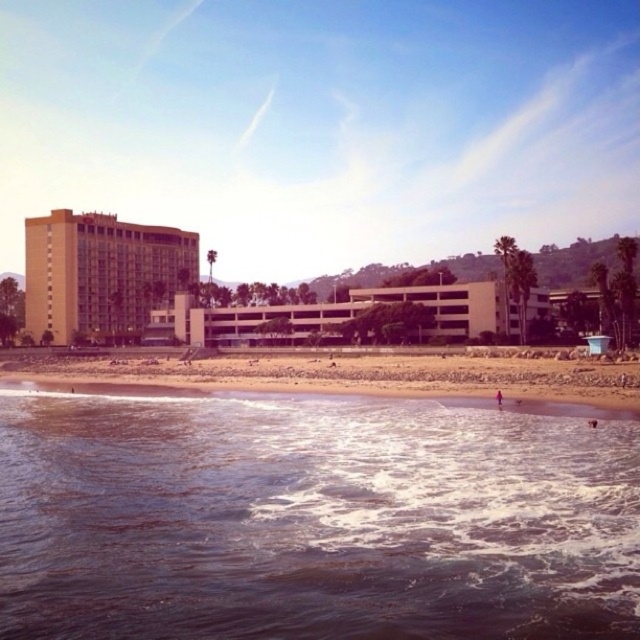
Looking at this image, you are standing at the beach and see the point marked as point (100, 275). What does this point represent?

The point (100, 275) represents the beige concrete building at left.

You are standing at the beach and want to take a photo of the brown sand at lower center and the beige concrete parking garage at center. Which object is closer to the camera?

The brown sand at lower center is closer to the camera because it is not as tall as the beige concrete parking garage at center, indicating it is in the foreground.

You are standing on the beach and see the brown water at lower left and the brown sand at lower center. Which one is closer to your feet?

The brown water at lower left is closer to your feet since it is positioned below the brown sand at lower center.